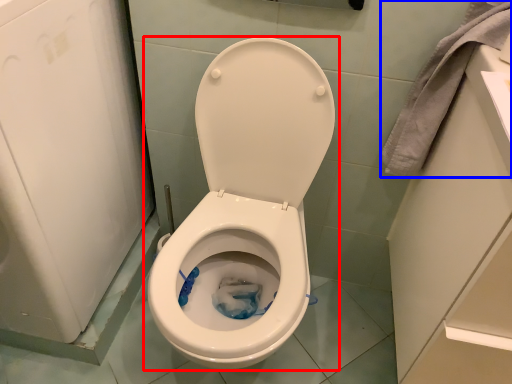
Question: Which point is further to the camera, toilet (highlighted by a red box) or material (highlighted by a blue box)?

Choices:
 (A) toilet
 (B) material

Answer: (B)